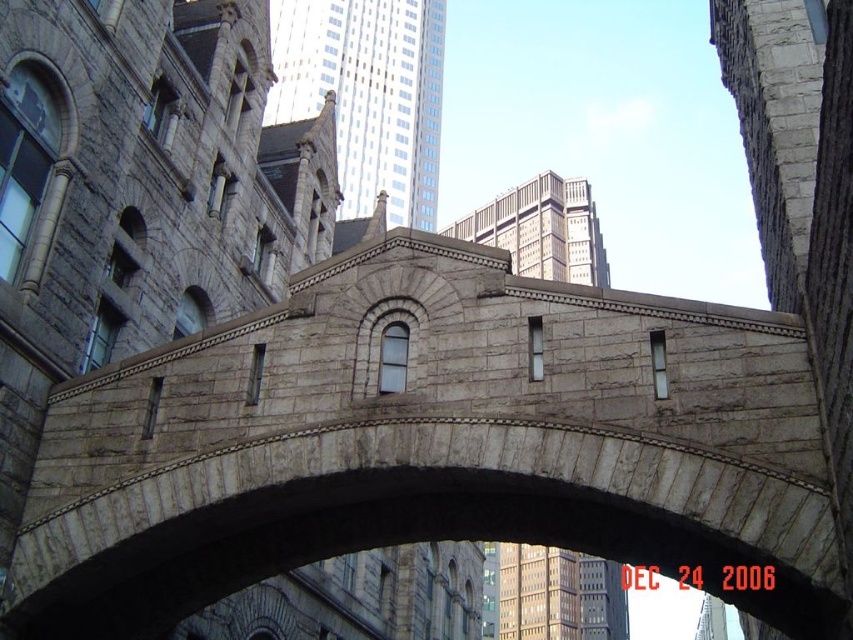
Question: Does smooth gray stone tower at upper center have a larger size compared to gray stone tower at upper center?

Choices:
 (A) yes
 (B) no

Answer: (A)

Question: Is smooth gray stone tower at upper center above gray stone tower at upper center?

Choices:
 (A) yes
 (B) no

Answer: (A)

Question: Does smooth gray stone tower at upper center appear on the left side of gray stone tower at upper center?

Choices:
 (A) no
 (B) yes

Answer: (B)